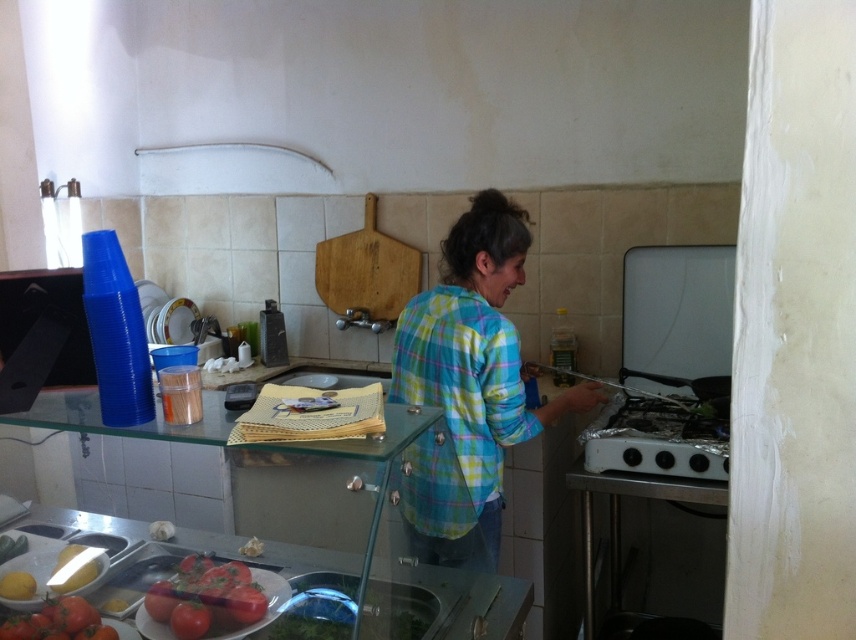
You are a kitchen assistant who needs to place a hot dish into the oven. The oven has a glass window on its door. To avoid touching the hot oven door, you decide to reach over the exhaust hood. Is the white glossy oven at right positioned below the white matte exhaust hood at upper center, making this possible?

Yes, the white glossy oven at right is positioned below the white matte exhaust hood at upper center, so you can safely reach over the exhaust hood to open the oven door without touching the hot surface.

You are a chef preparing a meal and need to reach the shiny red tomatoes at lower left. The white matte exhaust hood at upper center is in your way. Can you move the tomatoes to a higher shelf to avoid the hood?

The shiny red tomatoes at lower left are already positioned below the white matte exhaust hood at upper center, so moving them higher would place them under the hood. This might not be ideal due to potential heat or airflow from the hood affecting the tomatoes.